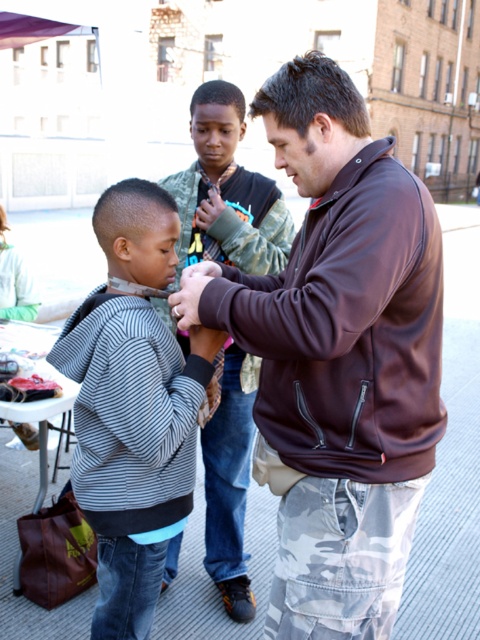
Does striped cotton hoodie at center lie behind striped fabric shirt at center?

No, it is not.

Consider the image. Is striped cotton hoodie at center bigger than striped fabric shirt at center?

Actually, striped cotton hoodie at center might be smaller than striped fabric shirt at center.

Find the location of a particular element. Image resolution: width=480 pixels, height=640 pixels. striped cotton hoodie at center is located at coordinates (132, 406).

Image resolution: width=480 pixels, height=640 pixels. I want to click on striped cotton hoodie at center, so click(x=132, y=406).

Between point (136, 314) and point (218, 408), which one is positioned in front?

Point (136, 314)

Is striped cotton sweatshirt at center below striped fabric shirt at center?

Yes.

Does point (100, 305) lie behind point (220, 548)?

No, it is not.

The height and width of the screenshot is (640, 480). Identify the location of striped cotton sweatshirt at center. point(130,413).

Based on the photo, is striped cotton hoodie at center positioned before striped cotton sweatshirt at center?

No, striped cotton hoodie at center is further to the viewer.

Does point (116, 349) come behind point (170, 337)?

No, (116, 349) is in front of (170, 337).

Find the location of a particular element. This screenshot has height=640, width=480. striped cotton hoodie at center is located at coordinates (132, 406).